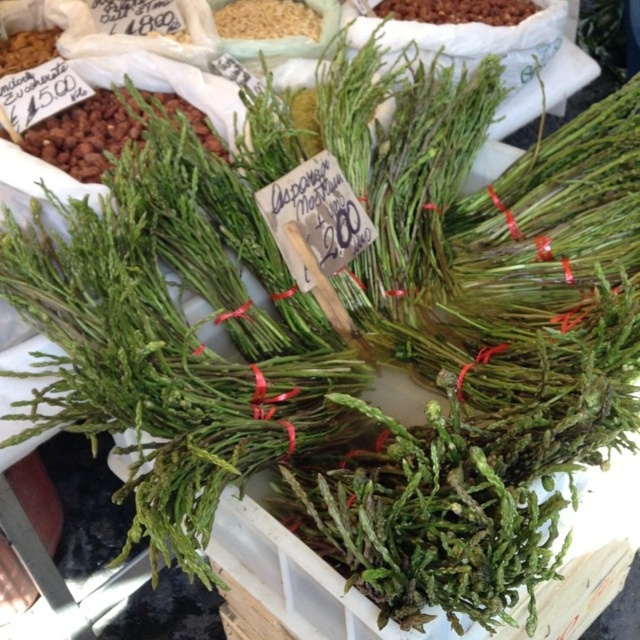
You are a customer at the market stall and want to buy both the green leafy vegetable at upper left and the brown grain at upper center. Which item is located to the left of the other?

The green leafy vegetable at upper left is positioned on the left side of brown grain at upper center.